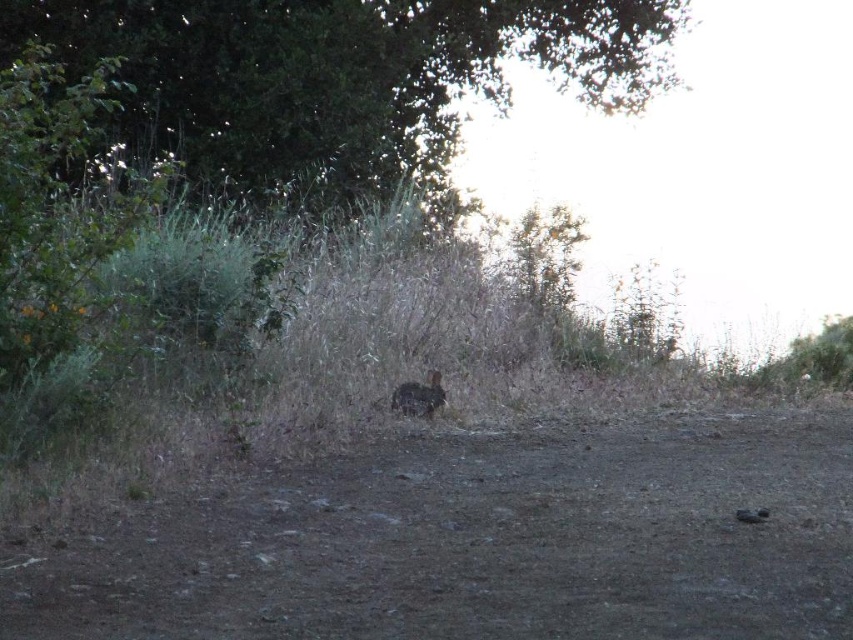
Question: Estimate the real-world distances between objects in this image. Which object is closer to the dull brown dirt at center?

Choices:
 (A) brown furry rabbit at center
 (B) green leafy tree at upper center

Answer: (A)

Question: In this image, where is dull brown dirt at center located relative to green leafy tree at upper center?

Choices:
 (A) above
 (B) below

Answer: (B)

Question: Is dull brown dirt at center above brown furry rabbit at center?

Choices:
 (A) yes
 (B) no

Answer: (B)

Question: Estimate the real-world distances between objects in this image. Which object is farther from the green leafy tree at upper center?

Choices:
 (A) brown furry rabbit at center
 (B) dull brown dirt at center

Answer: (B)

Question: Which object appears closest to the camera in this image?

Choices:
 (A) dull brown dirt at center
 (B) green leafy tree at upper center
 (C) brown furry rabbit at center

Answer: (A)

Question: Does dull brown dirt at center have a greater width compared to brown furry rabbit at center?

Choices:
 (A) yes
 (B) no

Answer: (A)